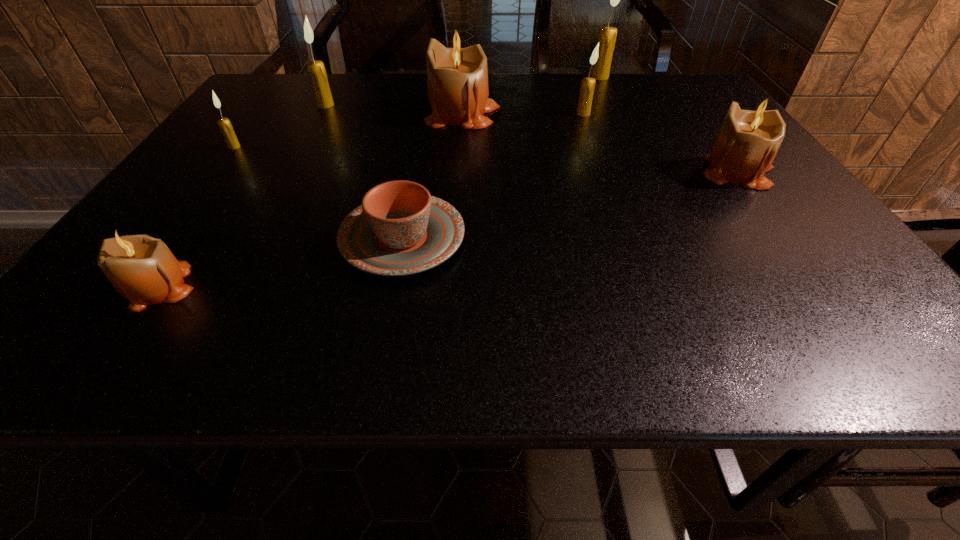
In the image, there is a desktop. Identify the location of vacant area at the near edge. This screenshot has height=540, width=960. (314, 321).

The height and width of the screenshot is (540, 960). I want to click on free space at the left edge, so click(235, 165).

Locate an element on the screen. This screenshot has width=960, height=540. vacant space at the far left corner is located at coordinates (267, 76).

This screenshot has width=960, height=540. I want to click on free spot between the shortest object and the leftmost cream candle, so click(319, 193).

You are a GUI agent. You are given a task and a screenshot of the screen. Output one action in this format:
    pyautogui.click(x=<x>, y=<y>)
    Task: Click on the empty space that is in between the second farthest beige candle and the shortest object
    
    Given the screenshot: What is the action you would take?
    pyautogui.click(x=570, y=205)

At what (x,y) coordinates should I click in order to perform the action: click on vacant space that's between the third biggest cream candle and the smallest cream candle. Please return your answer as a coordinate pair (x, y). The width and height of the screenshot is (960, 540). Looking at the image, I should click on (409, 130).

Locate an element on the screen. Image resolution: width=960 pixels, height=540 pixels. vacant space in between the third cream candle from left to right and the fourth nearest object is located at coordinates (409, 130).

What are the coordinates of `empty space between the fourth nearest object and the third candle from right to left` in the screenshot? It's located at click(409, 130).

The height and width of the screenshot is (540, 960). Find the location of `unoccupied area between the smallest beige candle and the shortest object`. unoccupied area between the smallest beige candle and the shortest object is located at coordinates (279, 262).

The image size is (960, 540). In order to click on blank region between the second farthest beige candle and the nearest cream candle in this screenshot , I will do `click(487, 159)`.